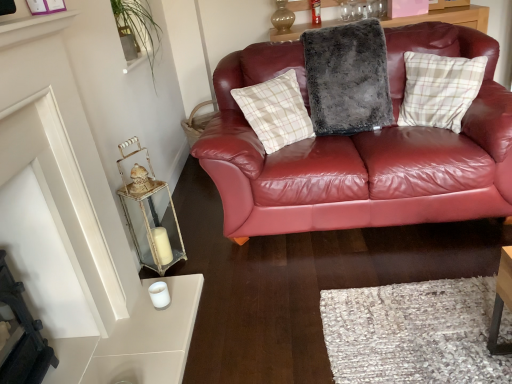
Question: Would you say metallic glass lantern at left is a long distance from plaid fabric pillow at upper right, acting as the 1th pillow starting from the right?

Choices:
 (A) yes
 (B) no

Answer: (A)

Question: Does metallic glass lantern at left come in front of plaid fabric pillow at upper right, the 2th pillow from the left?

Choices:
 (A) yes
 (B) no

Answer: (A)

Question: Is metallic glass lantern at left positioned behind plaid fabric pillow at upper right, acting as the 1th pillow starting from the right?

Choices:
 (A) no
 (B) yes

Answer: (A)

Question: Can you confirm if metallic glass lantern at left is positioned to the left of plaid fabric pillow at upper right, acting as the 1th pillow starting from the right?

Choices:
 (A) yes
 (B) no

Answer: (A)

Question: Does metallic glass lantern at left have a larger size compared to plaid fabric pillow at upper right, the 2th pillow from the left?

Choices:
 (A) yes
 (B) no

Answer: (B)

Question: Is white glossy shelf at upper left situated inside plaid fabric pillow at upper right, acting as the 1th pillow starting from the right, or outside?

Choices:
 (A) outside
 (B) inside

Answer: (A)

Question: Considering the positions of point (2, 39) and point (432, 76), is point (2, 39) closer or farther from the camera than point (432, 76)?

Choices:
 (A) closer
 (B) farther

Answer: (A)

Question: Considering the positions of white glossy shelf at upper left and plaid fabric pillow at upper right, the 2th pillow from the left, in the image, is white glossy shelf at upper left wider or thinner than plaid fabric pillow at upper right, the 2th pillow from the left,?

Choices:
 (A) thin
 (B) wide

Answer: (A)

Question: In the image, is white glossy shelf at upper left positioned in front of or behind plaid fabric pillow at upper right, the 2th pillow from the left?

Choices:
 (A) front
 (B) behind

Answer: (A)

Question: In terms of size, does plaid fabric pillow at upper right, the 2th pillow from the left, appear bigger or smaller than fuzzy gray pillow at center, the first pillow viewed from the left?

Choices:
 (A) big
 (B) small

Answer: (B)

Question: Does point (464, 66) appear closer or farther from the camera than point (334, 115)?

Choices:
 (A) closer
 (B) farther

Answer: (A)

Question: From a real-world perspective, is plaid fabric pillow at upper right, the 2th pillow from the left, above or below fuzzy gray pillow at center, which is counted as the second pillow, starting from the right?

Choices:
 (A) above
 (B) below

Answer: (B)

Question: Would you say plaid fabric pillow at upper right, acting as the 1th pillow starting from the right, is to the left or to the right of fuzzy gray pillow at center, which is counted as the second pillow, starting from the right, in the picture?

Choices:
 (A) left
 (B) right

Answer: (B)

Question: Considering the positions of fuzzy gray pillow at center, which is counted as the second pillow, starting from the right, and white glossy shelf at upper left in the image, is fuzzy gray pillow at center, which is counted as the second pillow, starting from the right, wider or thinner than white glossy shelf at upper left?

Choices:
 (A) wide
 (B) thin

Answer: (A)

Question: From the image's perspective, is fuzzy gray pillow at center, which is counted as the second pillow, starting from the right, located above or below white glossy shelf at upper left?

Choices:
 (A) above
 (B) below

Answer: (A)